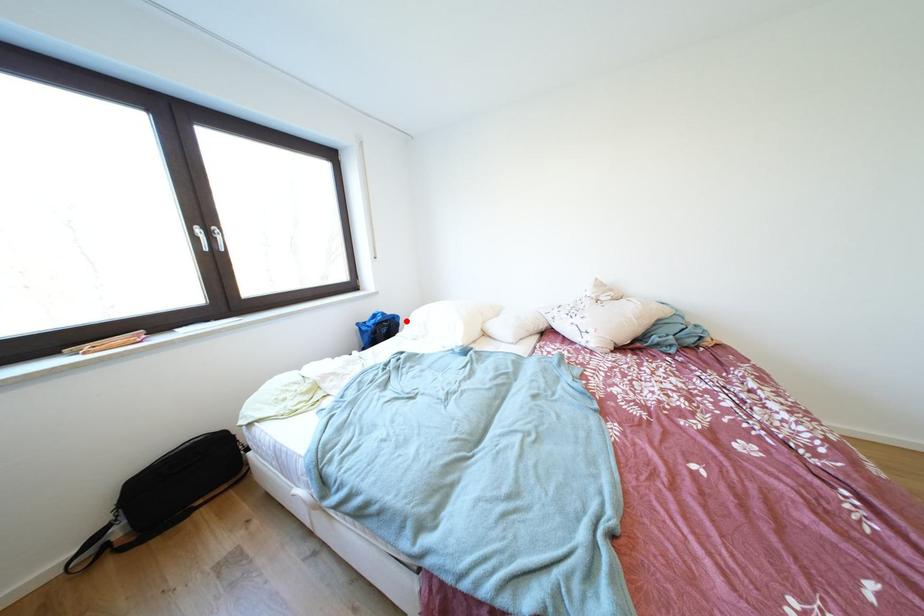
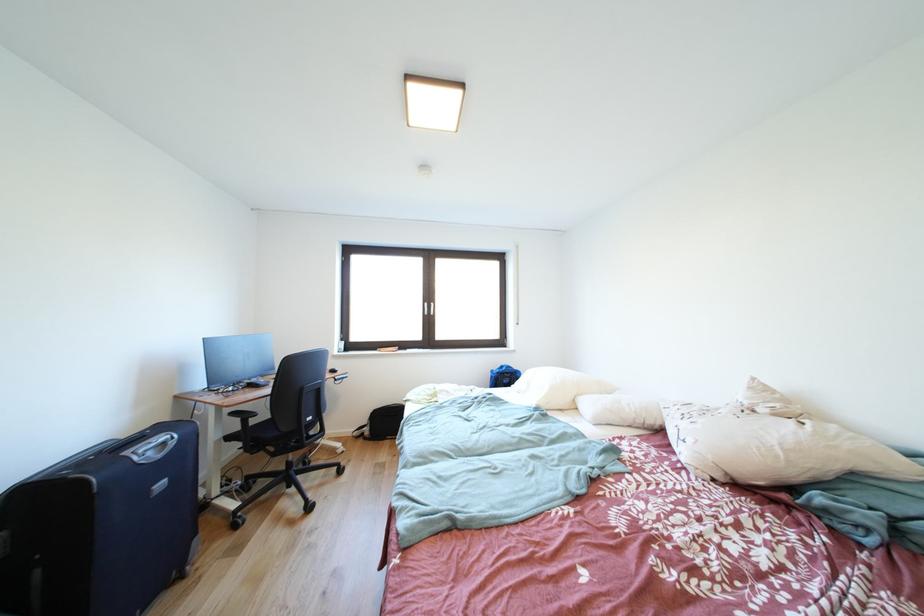
Question: I am providing you with two images of the same scene from different viewpoints. A red point is shown in image1. For the corresponding object point in image2, is it positioned nearer or farther from the camera?

Choices:
 (A) Nearer
 (B) Farther

Answer: (B)